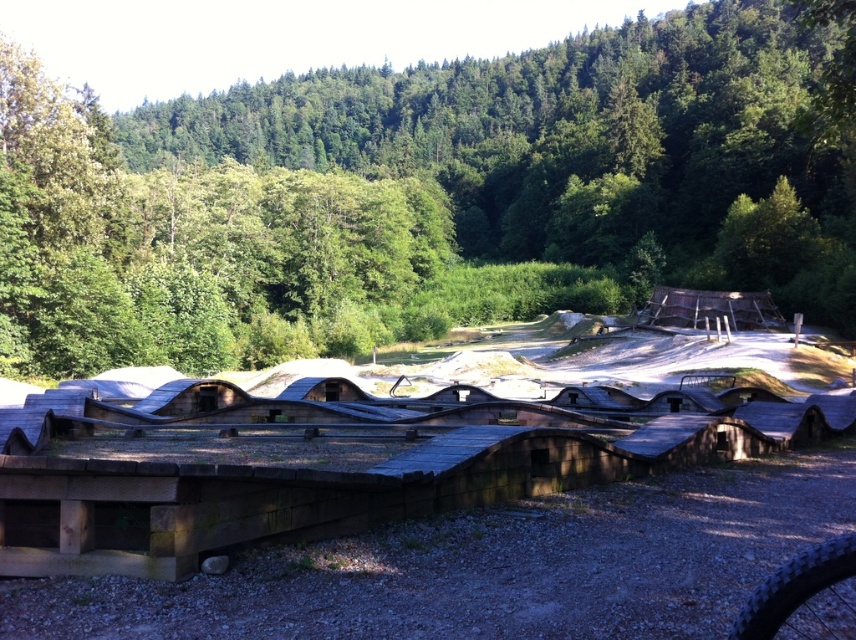
Between point (805, 173) and point (801, 602), which one is positioned behind?

Point (805, 173)

Does green leafy forest at upper center have a greater width compared to black rubber tire at lower right?

Indeed, green leafy forest at upper center has a greater width compared to black rubber tire at lower right.

Does point (52, 198) come behind point (738, 637)?

Yes, it is.

Locate an element on the screen. This screenshot has width=856, height=640. green leafy forest at upper center is located at coordinates (431, 193).